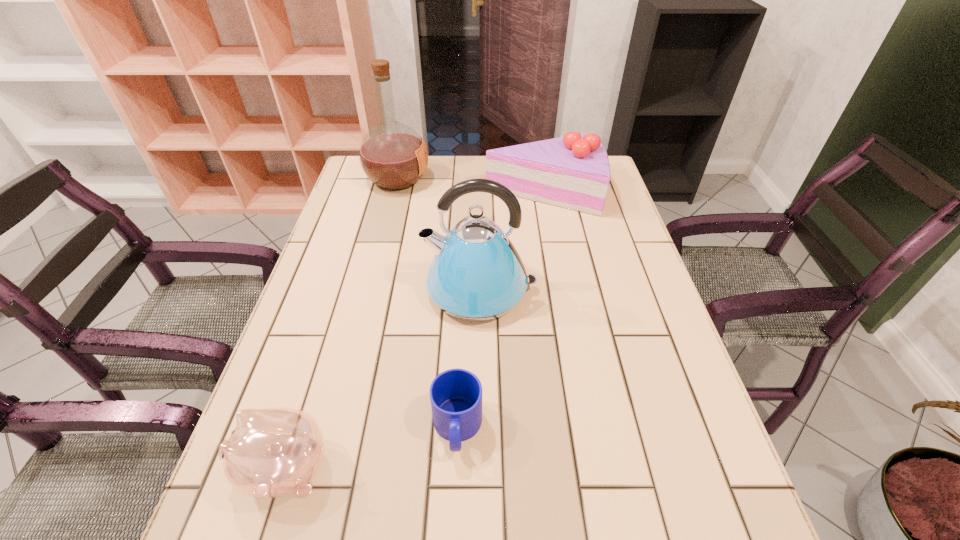
This screenshot has height=540, width=960. Find the location of `free space at the left edge of the desktop`. free space at the left edge of the desktop is located at coordinates (297, 372).

In the image, there is a desktop. What are the coordinates of `free space at the right edge` in the screenshot? It's located at (628, 329).

This screenshot has width=960, height=540. Find the location of `free space between the shortest object and the liquor`. free space between the shortest object and the liquor is located at coordinates (427, 303).

Where is `free point between the mug and the tallest object`? The height and width of the screenshot is (540, 960). free point between the mug and the tallest object is located at coordinates (427, 303).

Find the location of a particular element. This screenshot has height=540, width=960. free spot between the fourth tallest object and the shortest object is located at coordinates (372, 449).

This screenshot has height=540, width=960. In order to click on vacant area that lies between the third nearest object and the piggy bank in this screenshot , I will do `click(383, 379)`.

This screenshot has height=540, width=960. I want to click on free spot between the third tallest object and the second shortest object, so click(414, 330).

Identify the location of blank region between the piggy bank and the third shortest object. (414, 330).

You are a GUI agent. You are given a task and a screenshot of the screen. Output one action in this format:
    pyautogui.click(x=<x>, y=<y>)
    Task: Click on the vacant space that is in between the third nearest object and the mug
    The width and height of the screenshot is (960, 540).
    Given the screenshot: What is the action you would take?
    pyautogui.click(x=468, y=359)

The width and height of the screenshot is (960, 540). What are the coordinates of `free space that is in between the third tallest object and the fourth tallest object` in the screenshot? It's located at (414, 330).